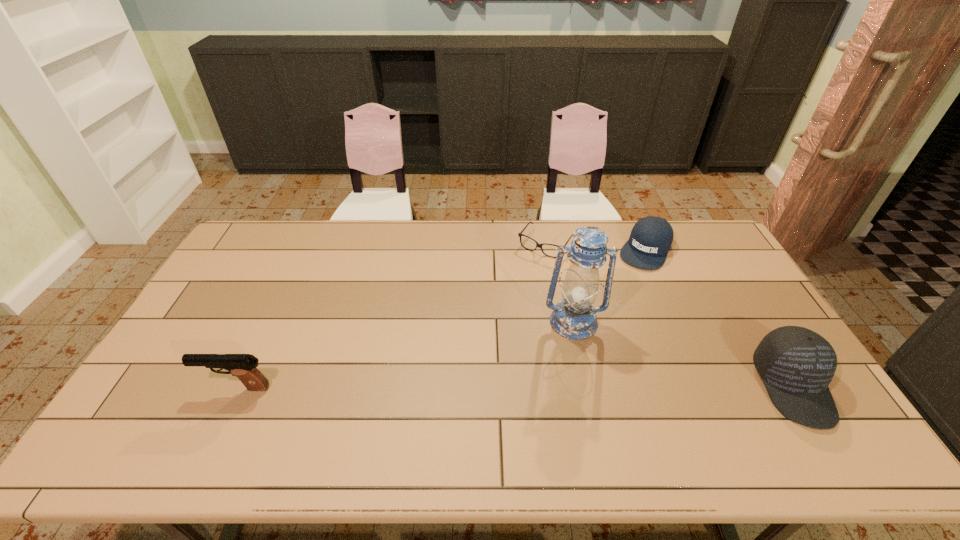
Where is `free location located 0.070m at the barrel of the pistol`? The image size is (960, 540). free location located 0.070m at the barrel of the pistol is located at coordinates (177, 388).

You are a GUI agent. You are given a task and a screenshot of the screen. Output one action in this format:
    pyautogui.click(x=<x>, y=<y>)
    Task: Click on the vacant space located 0.120m on the front-facing side of the second object from right to left
    The width and height of the screenshot is (960, 540).
    Given the screenshot: What is the action you would take?
    tap(627, 288)

Identify the location of vacant area located 0.330m on the front-facing side of the second object from right to left. This screenshot has width=960, height=540. (605, 329).

The height and width of the screenshot is (540, 960). Find the location of `vacant region located on the front-facing side of the second object from right to left`. vacant region located on the front-facing side of the second object from right to left is located at coordinates (620, 301).

This screenshot has width=960, height=540. Identify the location of free space located 0.090m on the front-facing side of the lantern. (578, 365).

The width and height of the screenshot is (960, 540). I want to click on free space located on the front-facing side of the lantern, so click(x=579, y=368).

Locate an element on the screen. The height and width of the screenshot is (540, 960). free point located on the front-facing side of the lantern is located at coordinates 583,403.

What are the coordinates of `vacant space situated 0.220m on the front-facing side of the shortest object` in the screenshot? It's located at (506, 296).

Find the location of a particular element. The width and height of the screenshot is (960, 540). free space located on the front-facing side of the shortest object is located at coordinates point(483,328).

Locate an element on the screen. The width and height of the screenshot is (960, 540). vacant point located 0.170m on the front-facing side of the shortest object is located at coordinates (514, 286).